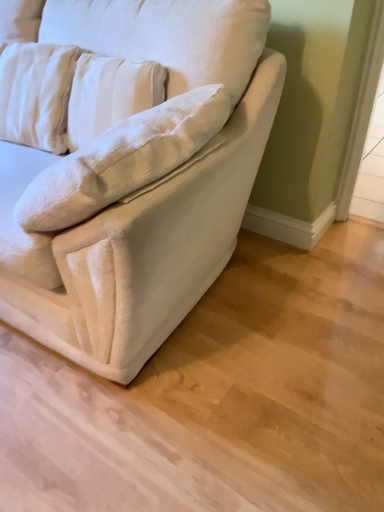
Image resolution: width=384 pixels, height=512 pixels. Find the location of `velvet white couch at center`. velvet white couch at center is located at coordinates (145, 187).

Describe the element at coordinates (145, 187) in the screenshot. The image size is (384, 512). I see `velvet white couch at center` at that location.

Identify the location of velvet white couch at center. (145, 187).